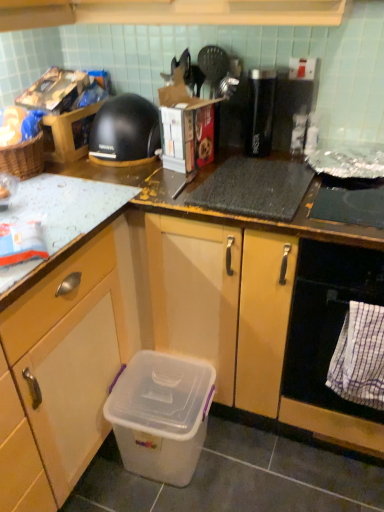
Question: Is black matte coffee maker at upper left bigger than white checkered towel at lower right?

Choices:
 (A) no
 (B) yes

Answer: (B)

Question: Does black matte coffee maker at upper left lie behind white checkered towel at lower right?

Choices:
 (A) no
 (B) yes

Answer: (B)

Question: Can you confirm if black matte coffee maker at upper left is shorter than white checkered towel at lower right?

Choices:
 (A) yes
 (B) no

Answer: (A)

Question: Considering the relative sizes of black matte coffee maker at upper left and white checkered towel at lower right in the image provided, is black matte coffee maker at upper left thinner than white checkered towel at lower right?

Choices:
 (A) no
 (B) yes

Answer: (A)

Question: Is white checkered towel at lower right at the back of black matte coffee maker at upper left?

Choices:
 (A) yes
 (B) no

Answer: (B)

Question: From a real-world perspective, is white checkered towel at lower right positioned above or below transparent plastic storage box at lower left?

Choices:
 (A) above
 (B) below

Answer: (A)

Question: Choose the correct answer: Is white checkered towel at lower right inside transparent plastic storage box at lower left or outside it?

Choices:
 (A) outside
 (B) inside

Answer: (A)

Question: Relative to transparent plastic storage box at lower left, is white checkered towel at lower right in front or behind?

Choices:
 (A) behind
 (B) front

Answer: (B)

Question: Considering the positions of white checkered towel at lower right and transparent plastic storage box at lower left in the image, is white checkered towel at lower right wider or thinner than transparent plastic storage box at lower left?

Choices:
 (A) thin
 (B) wide

Answer: (A)

Question: In terms of size, does black matte coffee maker at upper left appear bigger or smaller than black plastic toaster at upper right, which ranks as the second appliance in left-to-right order?

Choices:
 (A) big
 (B) small

Answer: (A)

Question: From their relative heights in the image, would you say black matte coffee maker at upper left is taller or shorter than black plastic toaster at upper right, which ranks as the second appliance in left-to-right order?

Choices:
 (A) short
 (B) tall

Answer: (A)

Question: Considering their positions, is black matte coffee maker at upper left located in front of or behind black plastic toaster at upper right, which ranks as the second appliance in left-to-right order?

Choices:
 (A) front
 (B) behind

Answer: (A)

Question: Considering the relative positions of black matte coffee maker at upper left and black plastic toaster at upper right, which ranks as the second appliance in left-to-right order, in the image provided, is black matte coffee maker at upper left to the left or to the right of black plastic toaster at upper right, which ranks as the second appliance in left-to-right order,?

Choices:
 (A) right
 (B) left

Answer: (B)

Question: From a real-world perspective, is black plastic toaster at upper right, marked as the first appliance in a right-to-left arrangement, positioned above or below matte plastic container at lower center?

Choices:
 (A) above
 (B) below

Answer: (A)

Question: Considering the positions of point (278, 128) and point (34, 396), is point (278, 128) closer or farther from the camera than point (34, 396)?

Choices:
 (A) closer
 (B) farther

Answer: (B)